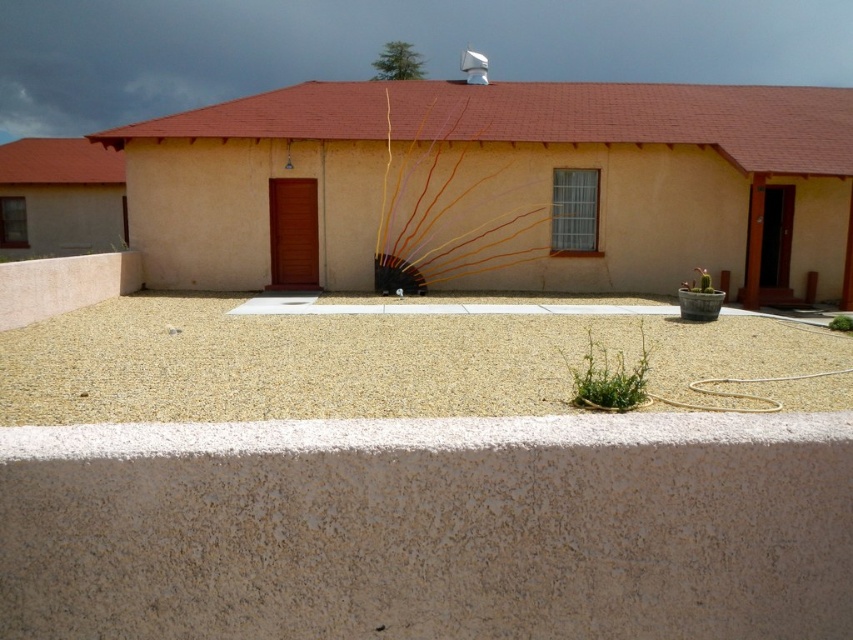
Is green matte cactus at right further to camera compared to green leafy plant at lower right?

Yes, it is.

Who is more forward, (706, 284) or (837, 316)?

Point (706, 284) is more forward.

Locate an element on the screen. The image size is (853, 640). green matte cactus at right is located at coordinates click(x=699, y=282).

Is green leafy plant at center below green matte cactus at right?

Yes.

Does point (610, 362) lie behind point (705, 282)?

No, it is in front of (705, 282).

Where is `green leafy plant at center`? green leafy plant at center is located at coordinates (608, 378).

Does light beige gravel at center have a greater height compared to green matte cactus at right?

Yes.

Who is more distant from viewer, (195, 374) or (705, 291)?

The point (705, 291) is more distant.

This screenshot has height=640, width=853. What do you see at coordinates (363, 362) in the screenshot?
I see `light beige gravel at center` at bounding box center [363, 362].

Where is `light beige gravel at center`? light beige gravel at center is located at coordinates (363, 362).